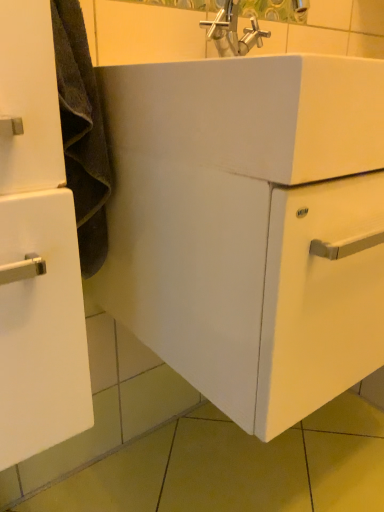
Question: Is point (286, 151) closer or farther from the camera than point (56, 440)?

Choices:
 (A) closer
 (B) farther

Answer: (A)

Question: Is white glossy sink at center bigger or smaller than white matte cabinet at left?

Choices:
 (A) big
 (B) small

Answer: (A)

Question: From the image's perspective, relative to white matte cabinet at left, is white glossy sink at center above or below?

Choices:
 (A) below
 (B) above

Answer: (B)

Question: From the image's perspective, is white matte cabinet at left above or below white glossy sink at center?

Choices:
 (A) below
 (B) above

Answer: (A)

Question: In terms of width, does white matte cabinet at left look wider or thinner when compared to white glossy sink at center?

Choices:
 (A) wide
 (B) thin

Answer: (B)

Question: Based on their sizes in the image, would you say white matte cabinet at left is bigger or smaller than white glossy sink at center?

Choices:
 (A) small
 (B) big

Answer: (A)

Question: Does point (21, 151) appear closer or farther from the camera than point (339, 139)?

Choices:
 (A) farther
 (B) closer

Answer: (B)